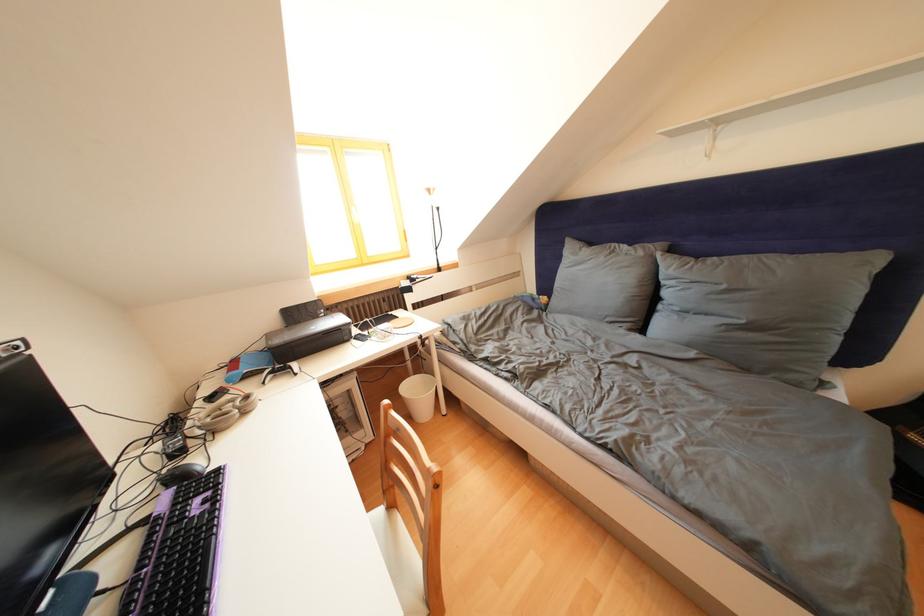
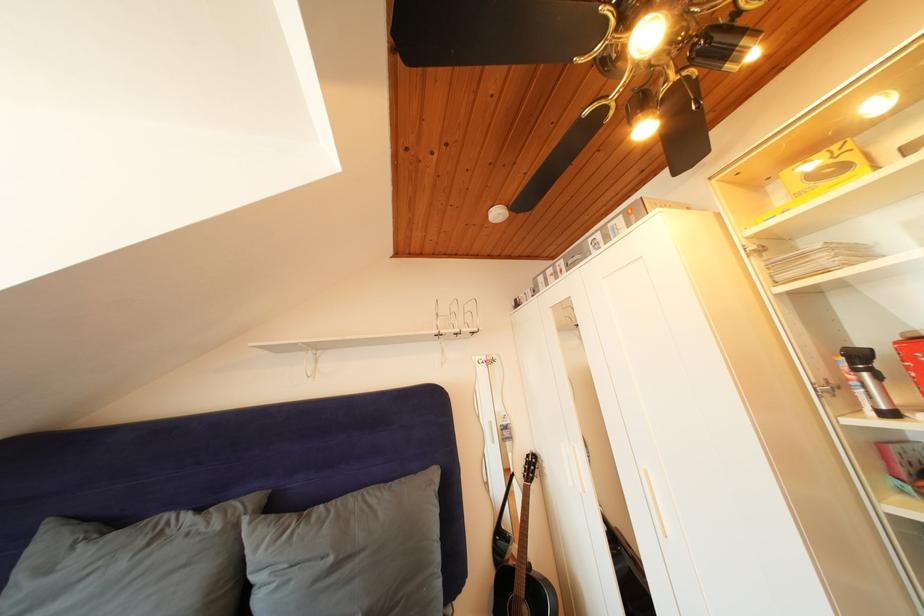
Where in the second image is the point corresponding to the point at 720,126 from the first image?

(315, 350)